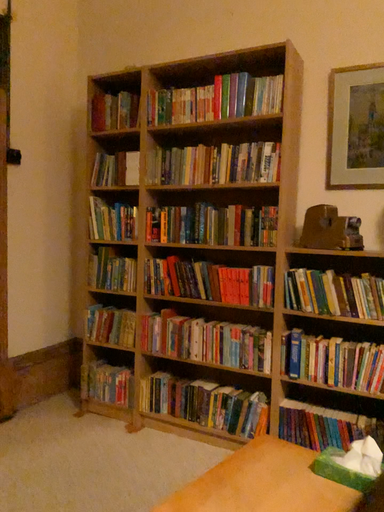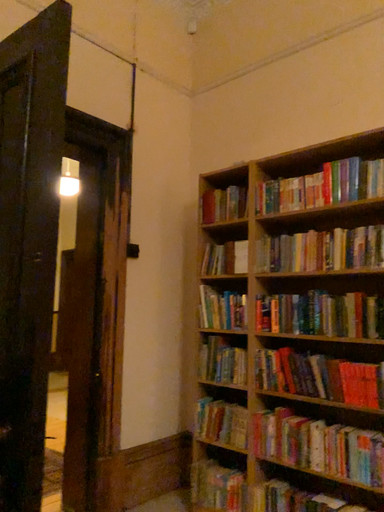
Question: How did the camera likely rotate when shooting the video?

Choices:
 (A) rotated left
 (B) rotated right

Answer: (A)